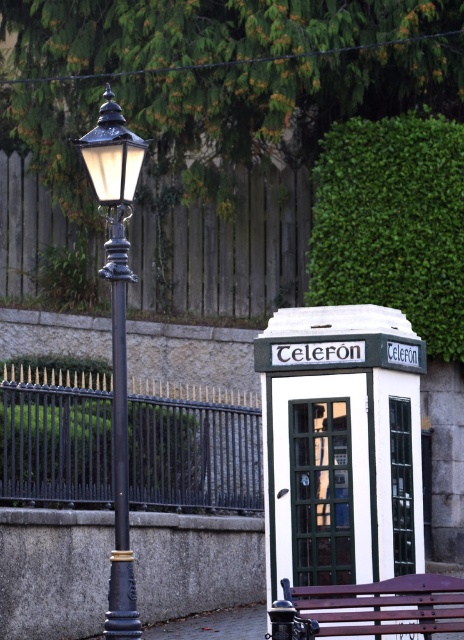
Question: Does black metal fence at center have a smaller size compared to brown wooden fence at upper center?

Choices:
 (A) no
 (B) yes

Answer: (A)

Question: Does black polished metal pole at left lie in front of matte black lamp at left?

Choices:
 (A) yes
 (B) no

Answer: (A)

Question: Which point appears closest to the camera in this image?

Choices:
 (A) (168, 499)
 (B) (232, 260)

Answer: (A)

Question: Which point appears closest to the camera in this image?

Choices:
 (A) (109, 630)
 (B) (256, 211)
 (C) (126, 625)
 (D) (70, 432)

Answer: (A)

Question: Which point is farther to the camera?

Choices:
 (A) (251, 244)
 (B) (116, 348)
 (C) (109, 115)
 (D) (315, 586)

Answer: (A)

Question: Does black metal fence at center have a greater width compared to matte black lamp at left?

Choices:
 (A) no
 (B) yes

Answer: (B)